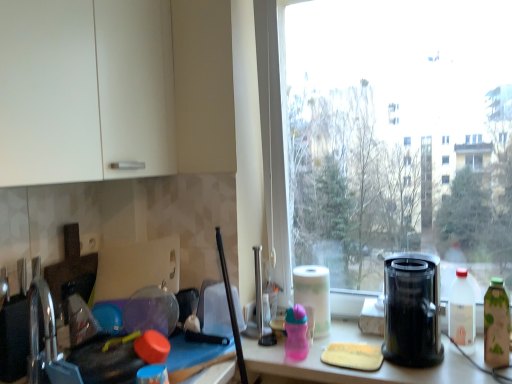
Question: From a real-world perspective, is white plastic bottle at right, arranged as the second bottle when viewed from the left, located higher than black plastic juicer at right?

Choices:
 (A) yes
 (B) no

Answer: (B)

Question: Could you tell me if white plastic bottle at right, which is counted as the 2th bottle, starting from the right, is turned towards black plastic juicer at right?

Choices:
 (A) yes
 (B) no

Answer: (B)

Question: Are white plastic bottle at right, which is counted as the 2th bottle, starting from the right, and black plastic juicer at right making contact?

Choices:
 (A) yes
 (B) no

Answer: (B)

Question: Does white plastic bottle at right, arranged as the second bottle when viewed from the left, have a lesser width compared to black plastic juicer at right?

Choices:
 (A) no
 (B) yes

Answer: (B)

Question: Considering the relative sizes of white plastic bottle at right, arranged as the second bottle when viewed from the left, and black plastic juicer at right in the image provided, is white plastic bottle at right, arranged as the second bottle when viewed from the left, smaller than black plastic juicer at right?

Choices:
 (A) yes
 (B) no

Answer: (A)

Question: Does point (303, 336) appear closer or farther from the camera than point (316, 292)?

Choices:
 (A) closer
 (B) farther

Answer: (A)

Question: From a real-world perspective, relative to white paper at window, is pink plastic sippy cup at center, which appears as the third bottle when viewed from the right, vertically above or below?

Choices:
 (A) above
 (B) below

Answer: (B)

Question: Based on their sizes in the image, would you say pink plastic sippy cup at center, the first bottle when ordered from left to right, is bigger or smaller than white paper at window?

Choices:
 (A) small
 (B) big

Answer: (A)

Question: Is pink plastic sippy cup at center, which appears as the third bottle when viewed from the right, in front of or behind white paper at window in the image?

Choices:
 (A) front
 (B) behind

Answer: (A)

Question: In the image, is white plastic bottle at right, which is counted as the 2th bottle, starting from the right, positioned in front of or behind white paper at window?

Choices:
 (A) front
 (B) behind

Answer: (A)

Question: From the image's perspective, is white plastic bottle at right, which is counted as the 2th bottle, starting from the right, positioned above or below white paper at window?

Choices:
 (A) above
 (B) below

Answer: (A)

Question: Is white plastic bottle at right, which is counted as the 2th bottle, starting from the right, situated inside white paper at window or outside?

Choices:
 (A) outside
 (B) inside

Answer: (A)

Question: Considering the positions of point (465, 312) and point (327, 301), is point (465, 312) closer or farther from the camera than point (327, 301)?

Choices:
 (A) farther
 (B) closer

Answer: (B)

Question: Is point (497, 347) closer or farther from the camera than point (393, 256)?

Choices:
 (A) farther
 (B) closer

Answer: (B)

Question: Is green matte bottle at right, which is the 3th bottle in left-to-right order, to the left or to the right of black plastic juicer at right in the image?

Choices:
 (A) left
 (B) right

Answer: (B)